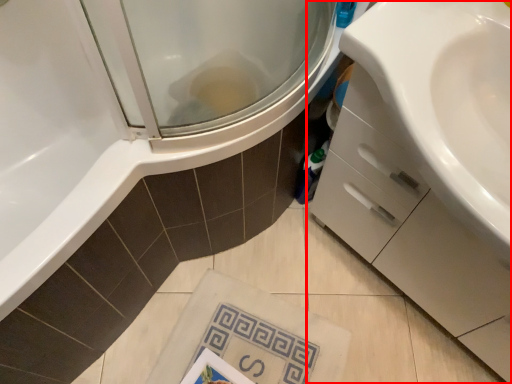
Question: Where is bathroom cabinet (annotated by the red box) located in relation to beach towel in the image?

Choices:
 (A) left
 (B) right

Answer: (B)